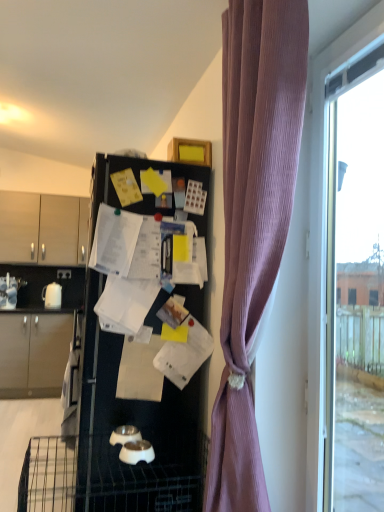
Question: Does transparent glass window at right have a smaller size compared to purple ribbed curtain at right?

Choices:
 (A) yes
 (B) no

Answer: (A)

Question: Is transparent glass window at right to the left of purple ribbed curtain at right from the viewer's perspective?

Choices:
 (A) yes
 (B) no

Answer: (B)

Question: Could you tell me if transparent glass window at right is facing purple ribbed curtain at right?

Choices:
 (A) no
 (B) yes

Answer: (B)

Question: Is transparent glass window at right located outside purple ribbed curtain at right?

Choices:
 (A) no
 (B) yes

Answer: (B)

Question: Would you consider transparent glass window at right to be distant from purple ribbed curtain at right?

Choices:
 (A) no
 (B) yes

Answer: (A)

Question: From the image's perspective, would you say transparent glass window at right is positioned over purple ribbed curtain at right?

Choices:
 (A) yes
 (B) no

Answer: (B)

Question: Is black matte refrigerator at center not close to transparent glass window at right?

Choices:
 (A) no
 (B) yes

Answer: (A)

Question: Is black matte refrigerator at center at the right side of transparent glass window at right?

Choices:
 (A) no
 (B) yes

Answer: (A)

Question: Considering the relative sizes of black matte refrigerator at center and transparent glass window at right in the image provided, is black matte refrigerator at center taller than transparent glass window at right?

Choices:
 (A) no
 (B) yes

Answer: (B)

Question: Can you confirm if black matte refrigerator at center is thinner than transparent glass window at right?

Choices:
 (A) no
 (B) yes

Answer: (A)

Question: From the image's perspective, is black matte refrigerator at center beneath transparent glass window at right?

Choices:
 (A) yes
 (B) no

Answer: (A)

Question: Is black matte refrigerator at center directly adjacent to transparent glass window at right?

Choices:
 (A) no
 (B) yes

Answer: (A)

Question: Does purple ribbed curtain at right turn towards black matte refrigerator at center?

Choices:
 (A) no
 (B) yes

Answer: (A)